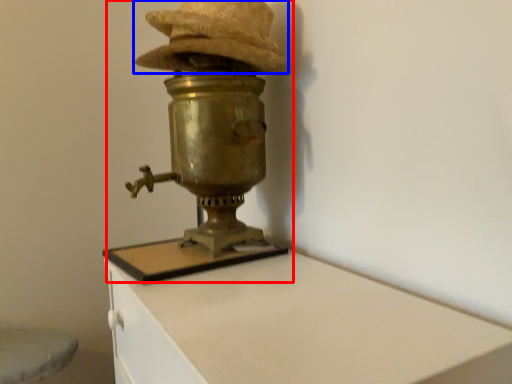
Question: Which of the following is the closest to the observer, table lamp (highlighted by a red box) or hat (highlighted by a blue box)?

Choices:
 (A) table lamp
 (B) hat

Answer: (A)